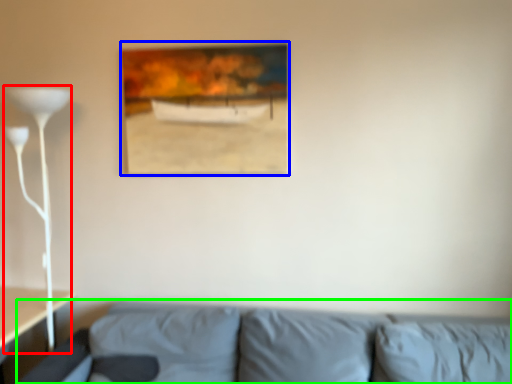
Question: Which object is the farthest from table lamp (highlighted by a red box)? Choose among these: picture frame (highlighted by a blue box) or studio couch (highlighted by a green box).

Choices:
 (A) picture frame
 (B) studio couch

Answer: (B)